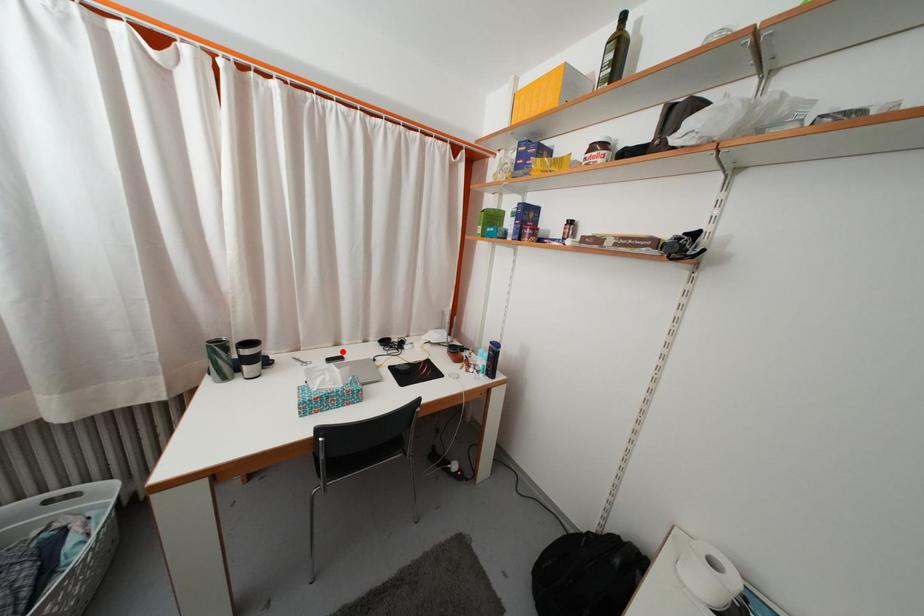
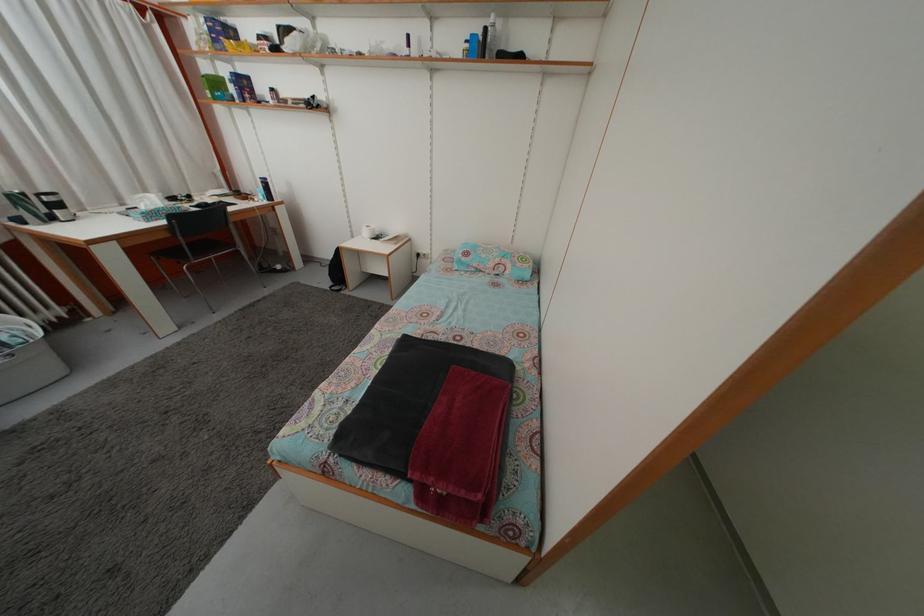
Question: I am providing you with two images of the same scene from different viewpoints. A red point is shown in image1. For the corresponding object point in image2, is it positioned nearer or farther from the camera?

Choices:
 (A) Nearer
 (B) Farther

Answer: (B)